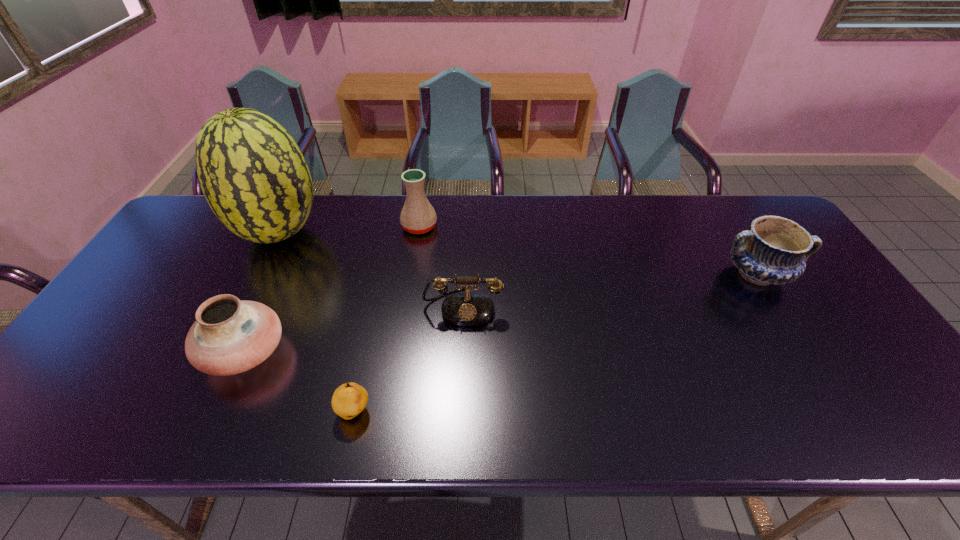
Find the location of a particular element. This screenshot has width=960, height=540. the tallest object is located at coordinates (253, 175).

What are the coordinates of `the second pottery from left to right` in the screenshot? It's located at (418, 216).

You are a GUI agent. You are given a task and a screenshot of the screen. Output one action in this format:
    pyautogui.click(x=<x>, y=<y>)
    Task: Click on the farthest pottery
    
    Given the screenshot: What is the action you would take?
    pyautogui.click(x=418, y=216)

The height and width of the screenshot is (540, 960). What are the coordinates of `the second farthest pottery` in the screenshot? It's located at (774, 251).

The height and width of the screenshot is (540, 960). I want to click on the rightmost object, so click(x=774, y=251).

At what (x,y) coordinates should I click in order to perform the action: click on the nearest pottery. Please return your answer as a coordinate pair (x, y). The image size is (960, 540). Looking at the image, I should click on (230, 336).

The width and height of the screenshot is (960, 540). What are the coordinates of `telephone` in the screenshot? It's located at (468, 308).

Where is `the shortest object`? This screenshot has height=540, width=960. the shortest object is located at coordinates (349, 400).

The height and width of the screenshot is (540, 960). In order to click on pear in this screenshot , I will do `click(349, 400)`.

What are the coordinates of `free space located on the front of the tallest object` in the screenshot? It's located at (240, 312).